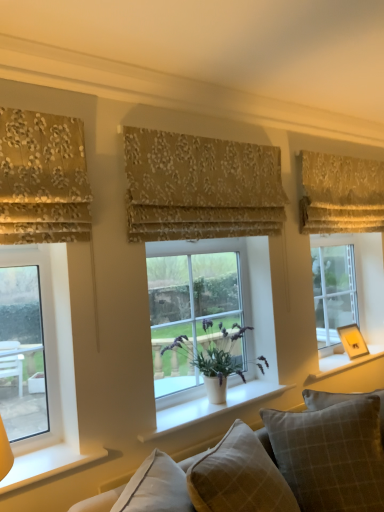
Question: Is plaid fabric pillow at lower right, which is counted as the first pillow, starting from the right, at the left side of clear glass window at right, which is counted as the 1th window, starting from the back?

Choices:
 (A) no
 (B) yes

Answer: (B)

Question: Can you confirm if plaid fabric pillow at lower right, which is counted as the first pillow, starting from the right, is smaller than clear glass window at right, the 3th window from the front?

Choices:
 (A) yes
 (B) no

Answer: (B)

Question: Is the surface of plaid fabric pillow at lower right, positioned as the second pillow in left-to-right order, in direct contact with clear glass window at right, the 3th window from the front?

Choices:
 (A) no
 (B) yes

Answer: (A)

Question: Is plaid fabric pillow at lower right, which is counted as the first pillow, starting from the right, outside clear glass window at right, which is counted as the 1th window, starting from the back?

Choices:
 (A) no
 (B) yes

Answer: (B)

Question: Is plaid fabric pillow at lower right, which is counted as the first pillow, starting from the right, in front of clear glass window at right, which is counted as the 1th window, starting from the back?

Choices:
 (A) no
 (B) yes

Answer: (B)

Question: Does point (375, 304) appear closer or farther from the camera than point (240, 390)?

Choices:
 (A) closer
 (B) farther

Answer: (B)

Question: Is clear glass window at right, the 3th window positioned from the left, wider or thinner than white smooth window sill at center, placed as the second window sill when sorted from back to front?

Choices:
 (A) wide
 (B) thin

Answer: (B)

Question: Looking at the image, does clear glass window at right, the 3th window from the front, seem bigger or smaller compared to white smooth window sill at center, the 2th window sill in the right-to-left sequence?

Choices:
 (A) big
 (B) small

Answer: (A)

Question: Is clear glass window at right, acting as the 1th window starting from the right, inside or outside of white smooth window sill at center, placed as the second window sill when sorted from back to front?

Choices:
 (A) inside
 (B) outside

Answer: (B)

Question: From a real-world perspective, is translucent glass window at center, the second window positioned from the front, physically located above or below plaid fabric pillow at lower right, which is counted as the first pillow, starting from the right?

Choices:
 (A) below
 (B) above

Answer: (B)

Question: Looking at their shapes, would you say translucent glass window at center, which appears as the second window when viewed from the back, is wider or thinner than plaid fabric pillow at lower right, positioned as the second pillow in left-to-right order?

Choices:
 (A) wide
 (B) thin

Answer: (B)

Question: Is translucent glass window at center, the second window positioned from the front, taller or shorter than plaid fabric pillow at lower right, positioned as the second pillow in left-to-right order?

Choices:
 (A) tall
 (B) short

Answer: (A)

Question: Choose the correct answer: Is translucent glass window at center, the 2th window viewed from the left, inside plaid fabric pillow at lower right, which is counted as the first pillow, starting from the right, or outside it?

Choices:
 (A) outside
 (B) inside

Answer: (A)

Question: Is clear glass window at right, which is counted as the 1th window, starting from the back, bigger or smaller than gold floral fabric at upper left, placed as the 3th curtain when sorted from right to left?

Choices:
 (A) small
 (B) big

Answer: (B)

Question: From their relative heights in the image, would you say clear glass window at right, which is counted as the 1th window, starting from the back, is taller or shorter than gold floral fabric at upper left, the third curtain when ordered from back to front?

Choices:
 (A) short
 (B) tall

Answer: (B)